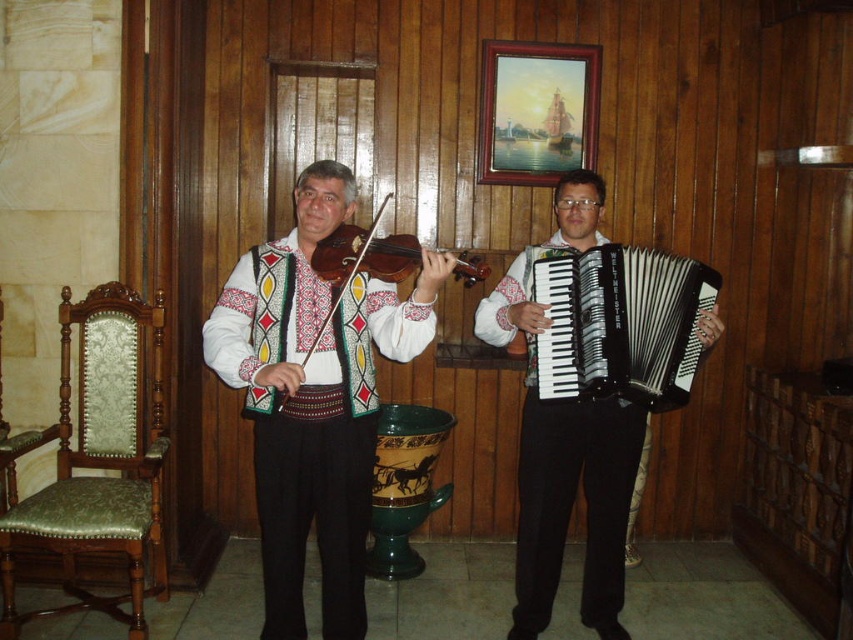
Question: Which object appears farthest from the camera in this image?

Choices:
 (A) black matte accordion at right
 (B) matte wood violin at left

Answer: (A)

Question: Which of the following is the farthest from the observer?

Choices:
 (A) matte wood violin at left
 (B) green fabric armchair at left
 (C) black plastic accordion at right

Answer: (B)

Question: Is the position of matte white violin at center more distant than that of green fabric armchair at left?

Choices:
 (A) yes
 (B) no

Answer: (B)

Question: Considering the relative positions of white embroidered vest at center and green fabric armchair at left in the image provided, where is white embroidered vest at center located with respect to green fabric armchair at left?

Choices:
 (A) above
 (B) below

Answer: (A)

Question: Which object appears farthest from the camera in this image?

Choices:
 (A) matte white violin at center
 (B) white embroidered vest at center
 (C) black plastic accordion at right
 (D) matte wood violin at left

Answer: (C)

Question: From the image, what is the correct spatial relationship of white embroidered vest at center in relation to matte white violin at center?

Choices:
 (A) below
 (B) above

Answer: (B)